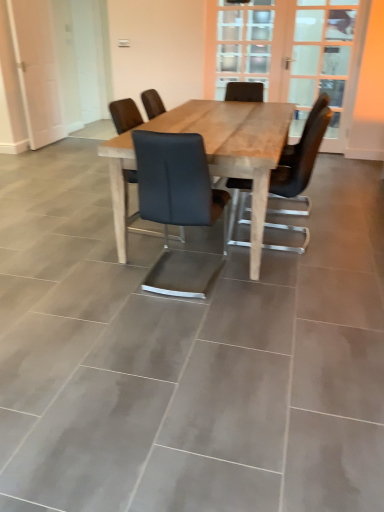
Identify the location of vacant region under black leather chair at center, acting as the 2th chair starting from the left (from a real-world perspective). Image resolution: width=384 pixels, height=512 pixels. (186, 281).